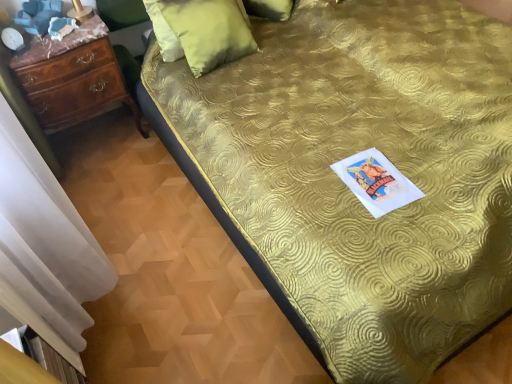
Find the location of `blank area beneath mahogany wood chest of drawers at left (from a real-world perspective)`. blank area beneath mahogany wood chest of drawers at left (from a real-world perspective) is located at coordinates (104, 144).